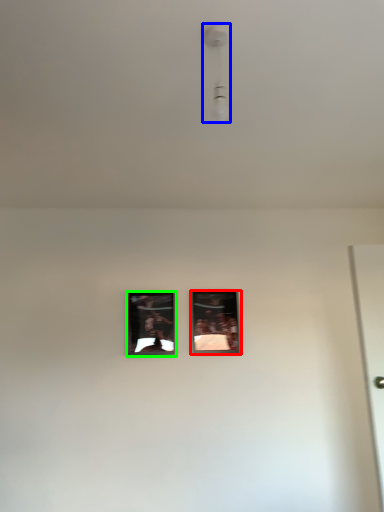
Question: Which is nearer to the picture frame (highlighted by a red box)? light fixture (highlighted by a blue box) or picture frame (highlighted by a green box).

Choices:
 (A) light fixture
 (B) picture frame

Answer: (B)